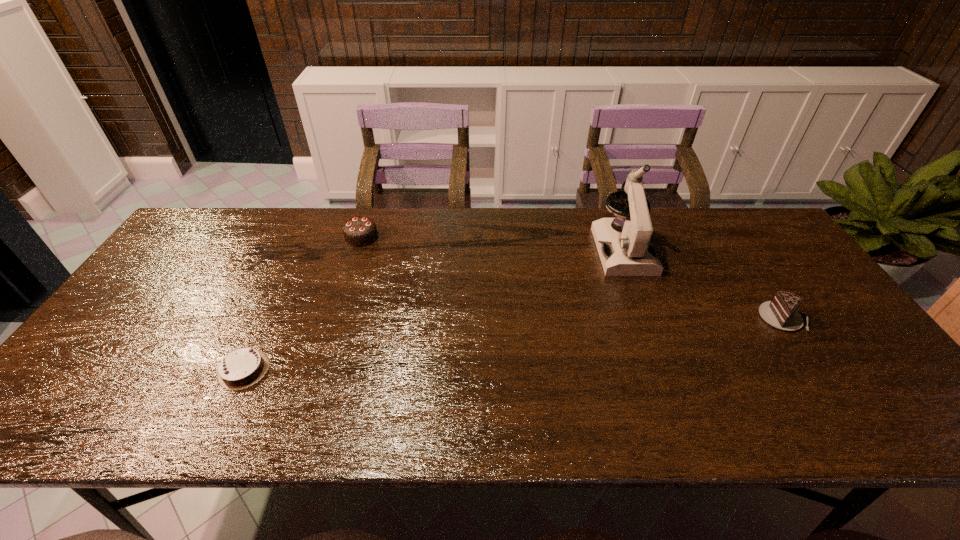
Where is `vacant region located 0.080m on the back of the second farthest chocolate cake`? Image resolution: width=960 pixels, height=540 pixels. vacant region located 0.080m on the back of the second farthest chocolate cake is located at coordinates 759,282.

This screenshot has width=960, height=540. What are the coordinates of `free space located 0.180m on the right of the leftmost chocolate cake` in the screenshot? It's located at (346, 369).

The width and height of the screenshot is (960, 540). I want to click on microscope situated at the far edge, so click(x=630, y=252).

Identify the location of chocolate cake at the far edge. The height and width of the screenshot is (540, 960). (360, 231).

The width and height of the screenshot is (960, 540). I want to click on object that is at the right edge, so pos(781,313).

Identify the location of vacant space at the far edge of the desktop. This screenshot has height=540, width=960. (252, 246).

Find the location of a particular element. vacant space at the near edge of the desktop is located at coordinates (374, 401).

In order to click on vacant space at the left edge of the desktop in this screenshot , I will do `click(90, 388)`.

Locate an element on the screen. The image size is (960, 540). vacant point at the right edge is located at coordinates (848, 357).

This screenshot has height=540, width=960. I want to click on free space between the microscope and the rightmost object, so click(703, 284).